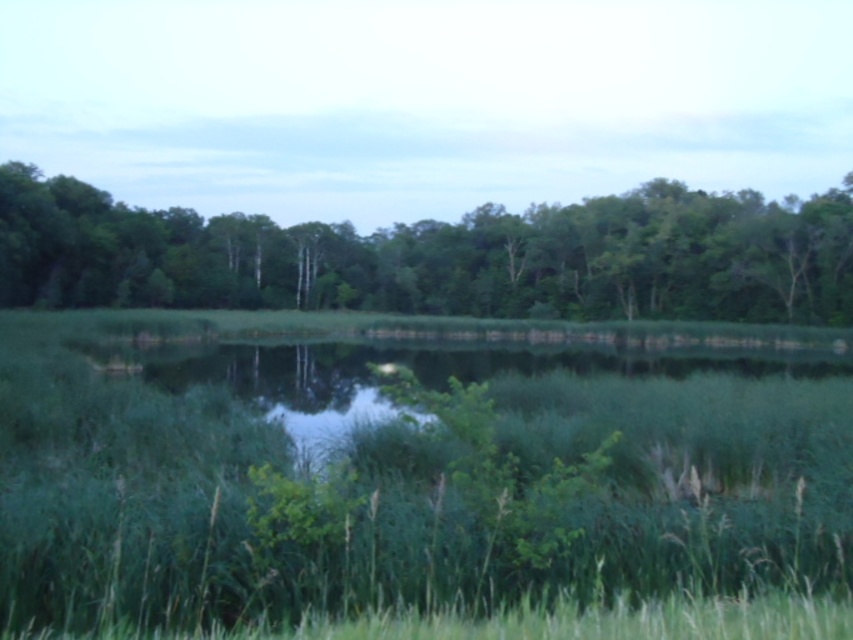
Question: Which point is farther from the camera taking this photo?

Choices:
 (A) (728, 508)
 (B) (746, 296)

Answer: (B)

Question: Is green grass at center bigger than green leafy trees at center?

Choices:
 (A) no
 (B) yes

Answer: (A)

Question: Is the position of green grass at center more distant than that of green leafy trees at center?

Choices:
 (A) yes
 (B) no

Answer: (B)

Question: Can you confirm if green grass at center is bigger than green leafy trees at center?

Choices:
 (A) no
 (B) yes

Answer: (A)